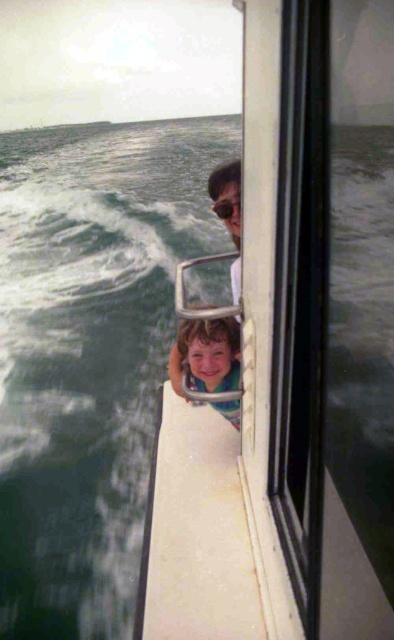
You are a photographer trying to capture the child in the boat scene. You need to ensure both the smooth skin face at center and the clear plastic goggles at upper center are in focus. Given that your camera can only focus on objects within a 60 cm range, will both be in focus?

The smooth skin face at center and clear plastic goggles at upper center are 76.39 centimeters apart from each other. Since the distance between them exceeds the camera focus range of 60 cm, both cannot be in focus simultaneously.

You are a photographer trying to capture the child in the boat scene. The child has a smooth skin face at center and clear plastic goggles at upper center. Which object is positioned closer to the camera lens? Please explain your reasoning based on the scene description.

The smooth skin face at center is closer to the viewer than the clear plastic goggles at upper center, so the smooth skin face at center would appear closer to the camera lens.